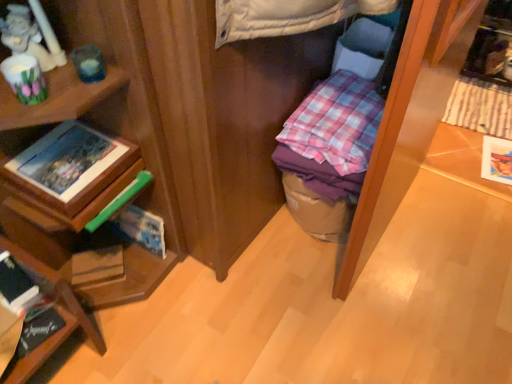
You are a GUI agent. You are given a task and a screenshot of the screen. Output one action in this format:
    pyautogui.click(x=<x>, y=<y>)
    Task: Click on the free location above matte paper paperback book at right, the third paperback book positioned from the left (from a real-world perspective)
    
    Given the screenshot: What is the action you would take?
    pyautogui.click(x=501, y=154)